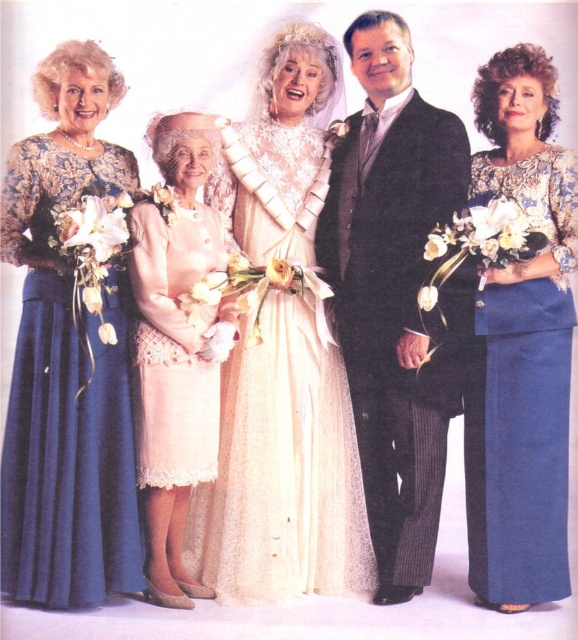
Question: Where is ivory lace dress at center located in relation to dark gray pinstripe suit at center in the image?

Choices:
 (A) left
 (B) right

Answer: (A)

Question: Observing the image, what is the correct spatial positioning of ivory lace dress at center in reference to light pink lace dress at center?

Choices:
 (A) left
 (B) right

Answer: (B)

Question: Is dark gray pinstripe suit at center further to the viewer compared to matte blue dress at left?

Choices:
 (A) no
 (B) yes

Answer: (B)

Question: Which object is the closest to the blue satin dress at right?

Choices:
 (A) matte blue dress at left
 (B) ivory lace dress at center
 (C) light pink lace dress at center
 (D) dark gray pinstripe suit at center

Answer: (D)

Question: Among these objects, which one is farthest from the camera?

Choices:
 (A) light pink lace dress at center
 (B) blue satin dress at right
 (C) dark gray pinstripe suit at center
 (D) matte blue dress at left

Answer: (C)

Question: Which point is closer to the camera taking this photo?

Choices:
 (A) (321, 173)
 (B) (376, 524)
 (C) (94, 465)
 (D) (560, 225)

Answer: (C)